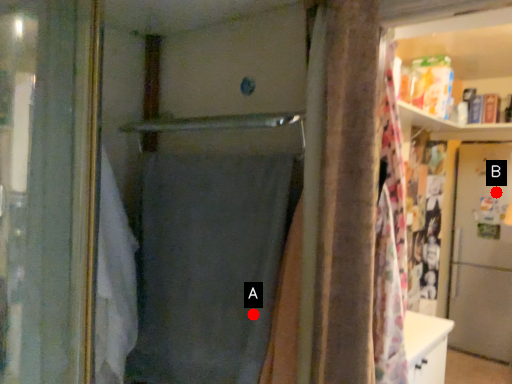
Question: Two points are circled on the image, labeled by A and B beside each circle. Which of the following is the closest to the observer?

Choices:
 (A) A is closer
 (B) B is closer

Answer: (A)